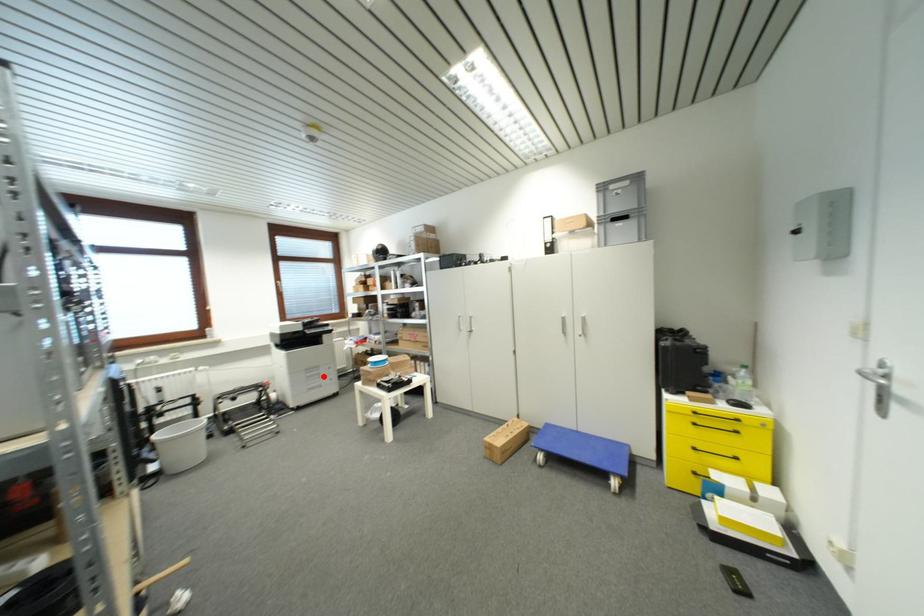
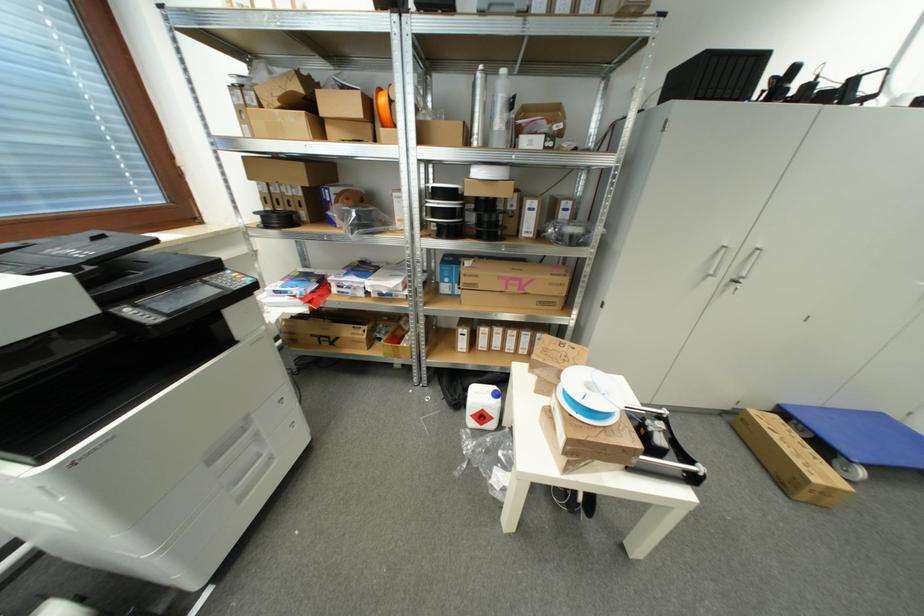
The point at the highlighted location is marked in the first image. Where is the corresponding point in the second image?

(261, 438)